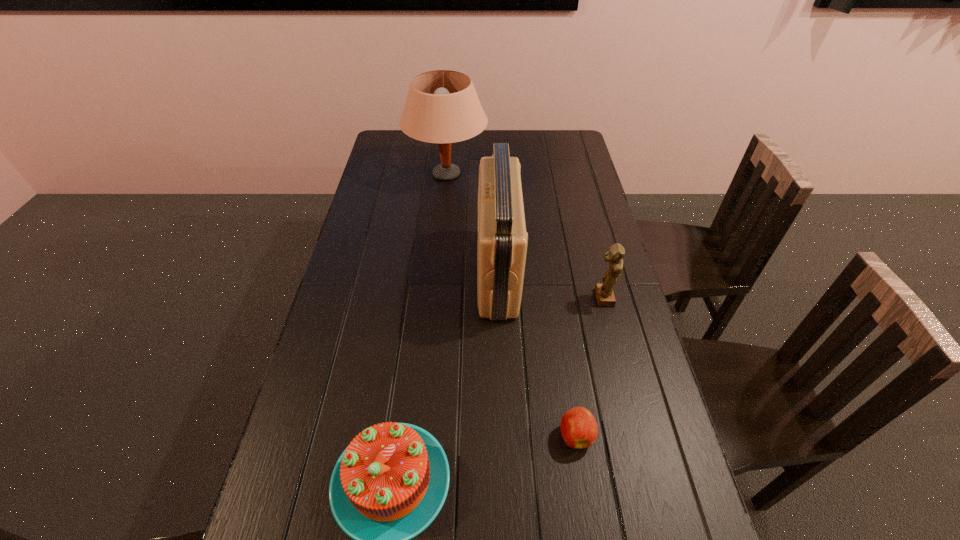
Locate an element on the screen. The height and width of the screenshot is (540, 960). free location located on the front-facing side of the third shortest object is located at coordinates (459, 298).

The height and width of the screenshot is (540, 960). I want to click on vacant space situated 0.240m on the front-facing side of the third shortest object, so click(x=513, y=298).

Image resolution: width=960 pixels, height=540 pixels. I want to click on vacant space positioned 0.090m on the front-facing side of the third shortest object, so click(563, 298).

Where is `vacant space located 0.050m on the back of the shortest object`? vacant space located 0.050m on the back of the shortest object is located at coordinates (570, 399).

Where is `object positioned at the far edge`? Image resolution: width=960 pixels, height=540 pixels. object positioned at the far edge is located at coordinates (442, 106).

This screenshot has height=540, width=960. I want to click on object present at the left edge, so click(x=442, y=106).

This screenshot has width=960, height=540. What are the coordinates of `object present at the right edge` in the screenshot? It's located at (604, 292).

Where is `object located at the far left corner`? Image resolution: width=960 pixels, height=540 pixels. object located at the far left corner is located at coordinates (442, 106).

The image size is (960, 540). In the image, there is a desktop. What are the coordinates of `vacant region at the far edge` in the screenshot? It's located at (529, 147).

The height and width of the screenshot is (540, 960). I want to click on free region at the left edge, so click(x=299, y=403).